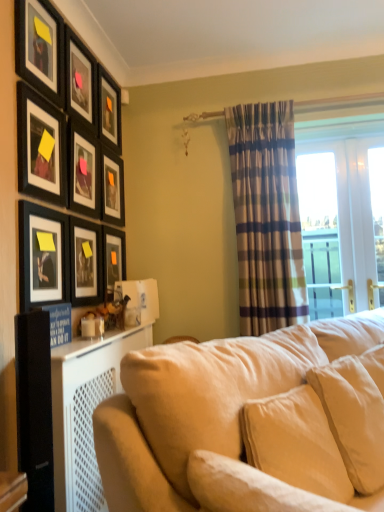
Question: From a real-world perspective, is matte black picture frame at upper left, the fifth picture frame positioned from the top, on top of matte black picture frame at upper left, which appears as the 2th picture frame when viewed from the top?

Choices:
 (A) yes
 (B) no

Answer: (B)

Question: Considering the relative sizes of matte black picture frame at upper left, the fifth picture frame positioned from the top, and matte black picture frame at upper left, which is the eighth picture frame in bottom-to-top order, in the image provided, is matte black picture frame at upper left, the fifth picture frame positioned from the top, taller than matte black picture frame at upper left, which is the eighth picture frame in bottom-to-top order,?

Choices:
 (A) yes
 (B) no

Answer: (A)

Question: From the image's perspective, is matte black picture frame at upper left, the fifth picture frame positioned from the top, on top of matte black picture frame at upper left, which appears as the 2th picture frame when viewed from the top?

Choices:
 (A) yes
 (B) no

Answer: (B)

Question: Does matte black picture frame at upper left, the 5th picture frame from the bottom, have a lesser width compared to matte black picture frame at upper left, which appears as the 2th picture frame when viewed from the top?

Choices:
 (A) no
 (B) yes

Answer: (A)

Question: Is matte black picture frame at upper left, the fifth picture frame positioned from the top, looking in the opposite direction of matte black picture frame at upper left, which is the eighth picture frame in bottom-to-top order?

Choices:
 (A) no
 (B) yes

Answer: (A)

Question: Looking at the image, does matte black picture frame at upper left, the 5th picture frame from the bottom, seem bigger or smaller compared to matte black picture frame at upper left, the 9th picture frame ordered from the bottom?

Choices:
 (A) big
 (B) small

Answer: (B)

Question: Considering the positions of point (72, 202) and point (61, 49), is point (72, 202) closer or farther from the camera than point (61, 49)?

Choices:
 (A) closer
 (B) farther

Answer: (B)

Question: Is matte black picture frame at upper left, the 5th picture frame from the bottom, wider or thinner than matte black picture frame at upper left, the 9th picture frame ordered from the bottom?

Choices:
 (A) thin
 (B) wide

Answer: (A)

Question: From a real-world perspective, is matte black picture frame at upper left, the fifth picture frame positioned from the top, positioned above or below matte black picture frame at upper left, acting as the first picture frame starting from the top?

Choices:
 (A) below
 (B) above

Answer: (A)

Question: Considering the positions of matte black picture frame at upper left, the 7th picture frame when ordered from bottom to top, and matte black picture frame at upper left, the fifth picture frame positioned from the top, in the image, is matte black picture frame at upper left, the 7th picture frame when ordered from bottom to top, taller or shorter than matte black picture frame at upper left, the fifth picture frame positioned from the top,?

Choices:
 (A) short
 (B) tall

Answer: (A)

Question: Is matte black picture frame at upper left, the third picture frame positioned from the top, inside or outside of matte black picture frame at upper left, the fifth picture frame positioned from the top?

Choices:
 (A) outside
 (B) inside

Answer: (A)

Question: In terms of size, does matte black picture frame at upper left, the third picture frame positioned from the top, appear bigger or smaller than matte black picture frame at upper left, the fifth picture frame positioned from the top?

Choices:
 (A) big
 (B) small

Answer: (A)

Question: In the image, is matte black picture frame at upper left, the third picture frame positioned from the top, on the left side or the right side of matte black picture frame at upper left, the fifth picture frame positioned from the top?

Choices:
 (A) right
 (B) left

Answer: (A)

Question: From the image's perspective, is beige velvety pillow at center, positioned as the 2th pillow in front-to-back order, above or below matte black picture frame at upper left, the fourth picture frame when ordered from top to bottom?

Choices:
 (A) above
 (B) below

Answer: (B)

Question: Considering the positions of beige velvety pillow at center, positioned as the 2th pillow in front-to-back order, and matte black picture frame at upper left, which is counted as the sixth picture frame, starting from the bottom, in the image, is beige velvety pillow at center, positioned as the 2th pillow in front-to-back order, bigger or smaller than matte black picture frame at upper left, which is counted as the sixth picture frame, starting from the bottom,?

Choices:
 (A) big
 (B) small

Answer: (A)